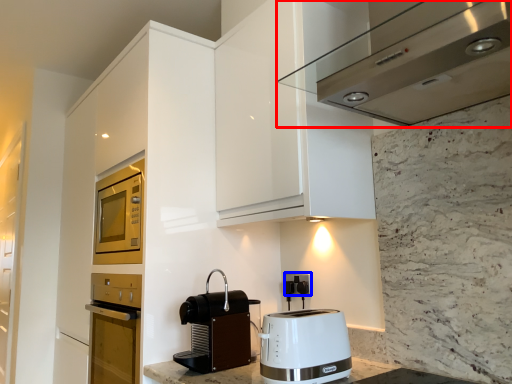
Question: Among these objects, which one is farthest to the camera, home appliance (highlighted by a red box) or electric outlet (highlighted by a blue box)?

Choices:
 (A) home appliance
 (B) electric outlet

Answer: (B)